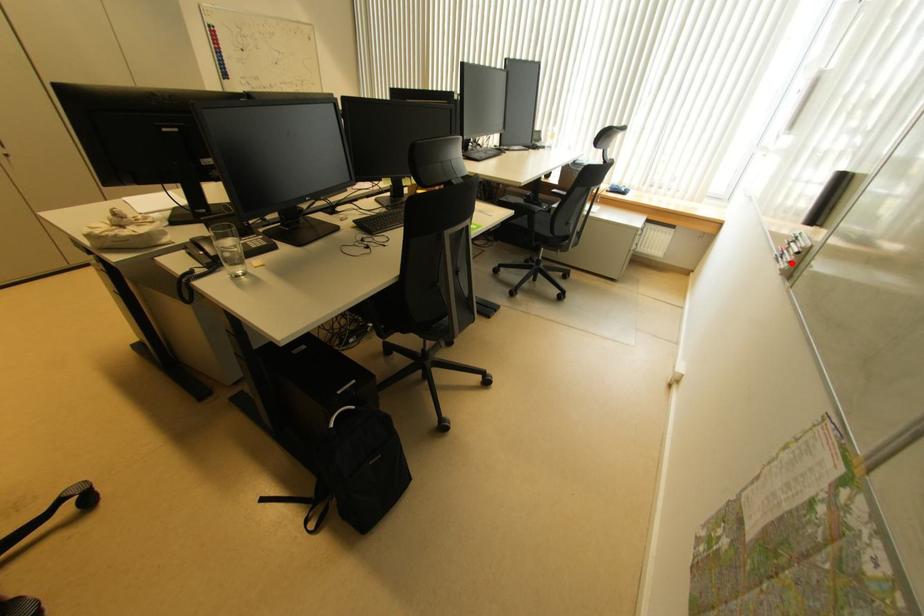
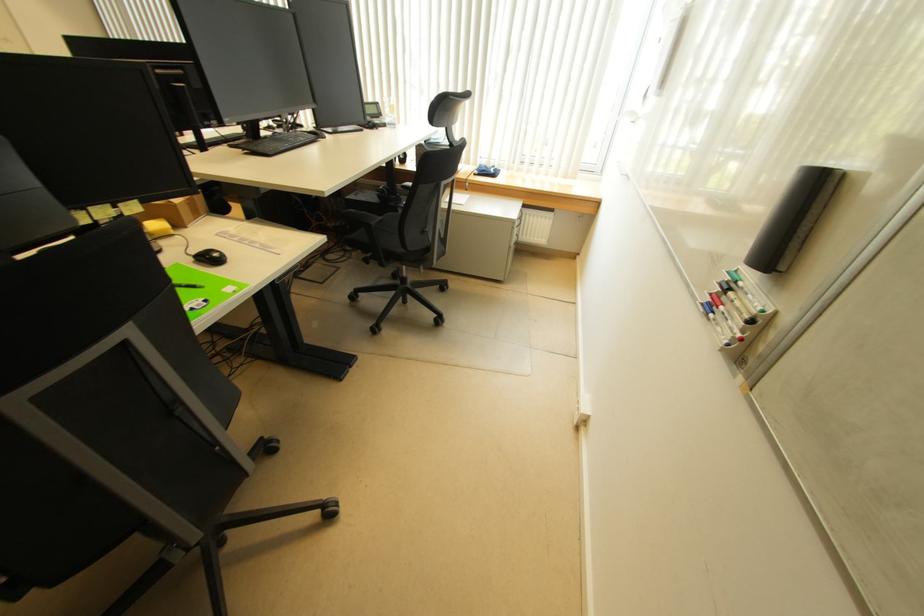
Question: I am providing you with two images of the same scene from different viewpoints. A red point is marked on the first image. At the location where the point appears in image 1, is it still visible in image 2?

Choices:
 (A) Yes
 (B) No

Answer: (A)